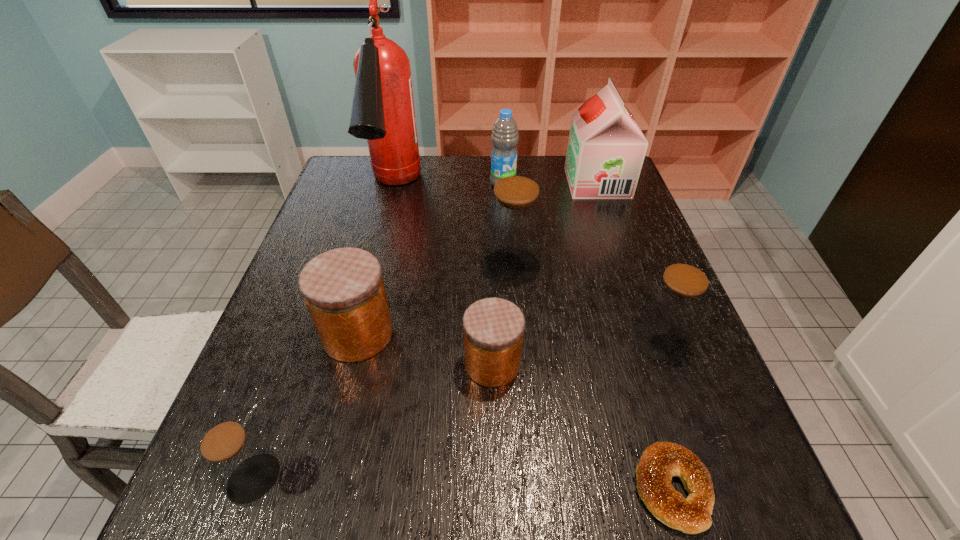
Locate an element on the screen. This screenshot has width=960, height=540. the nearest brown jar is located at coordinates (236, 458).

Where is `the smallest brown jar`? This screenshot has width=960, height=540. the smallest brown jar is located at coordinates (236, 458).

You are a GUI agent. You are given a task and a screenshot of the screen. Output one action in this format:
    pyautogui.click(x=<x>, y=<y>)
    Task: Click on the bagel
    This screenshot has height=540, width=960.
    Given the screenshot: What is the action you would take?
    pyautogui.click(x=660, y=461)

You are a GUI agent. You are given a task and a screenshot of the screen. Output one action in this format:
    pyautogui.click(x=<x>, y=<y>)
    Task: Click on the shortest object
    This screenshot has height=540, width=960.
    Given the screenshot: What is the action you would take?
    pyautogui.click(x=660, y=461)

The height and width of the screenshot is (540, 960). I want to click on free space located 0.400m at the nozzle end of the red fire extinguisher, so click(351, 358).

Locate an element on the screen. This screenshot has width=960, height=540. vacant area located with the cap open on the soya milk is located at coordinates (445, 183).

Identify the location of free space located 0.340m with the cap open on the soya milk. (458, 183).

Locate an element on the screen. Image resolution: width=960 pixels, height=540 pixels. vacant space located 0.220m with the cap open on the soya milk is located at coordinates (497, 183).

Find the location of a particular element. The width and height of the screenshot is (960, 540). vacant space located 0.050m on the right of the water bottle is located at coordinates (533, 184).

Image resolution: width=960 pixels, height=540 pixels. I want to click on free space located 0.200m on the left of the farthest jar, so click(x=401, y=266).